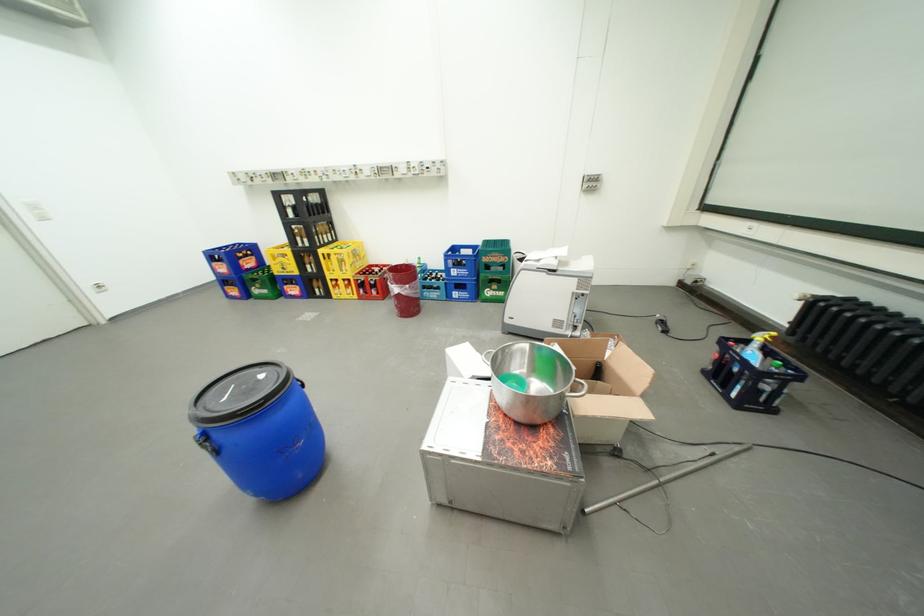
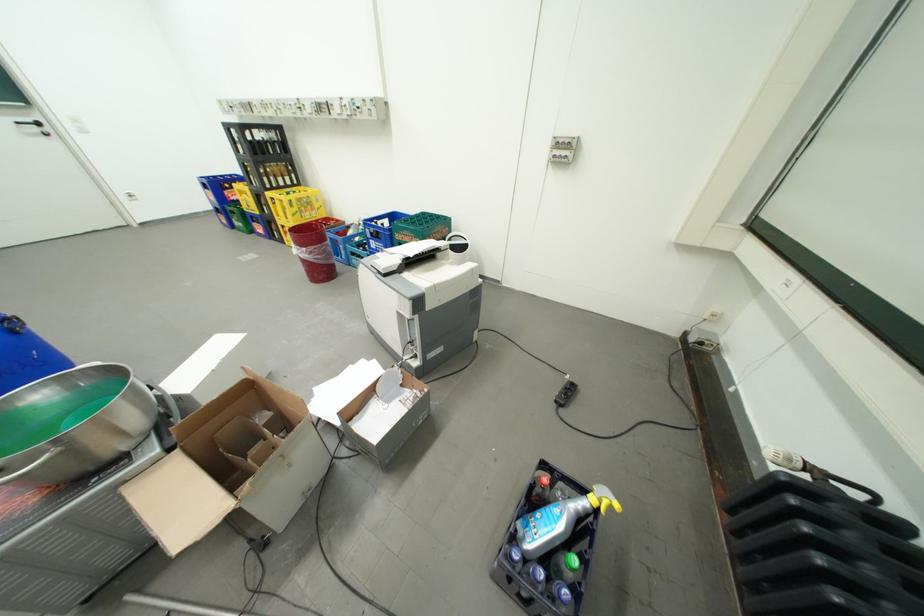
Where in the second image is the point corresponding to [783,339] from the first image?

(622, 509)